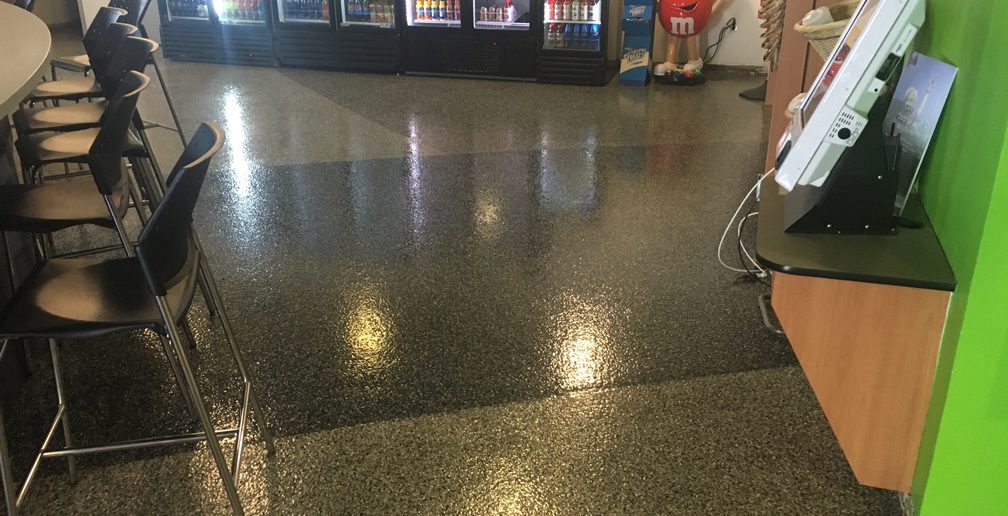
The image size is (1008, 516). Find the location of `floor`. floor is located at coordinates (461, 233).